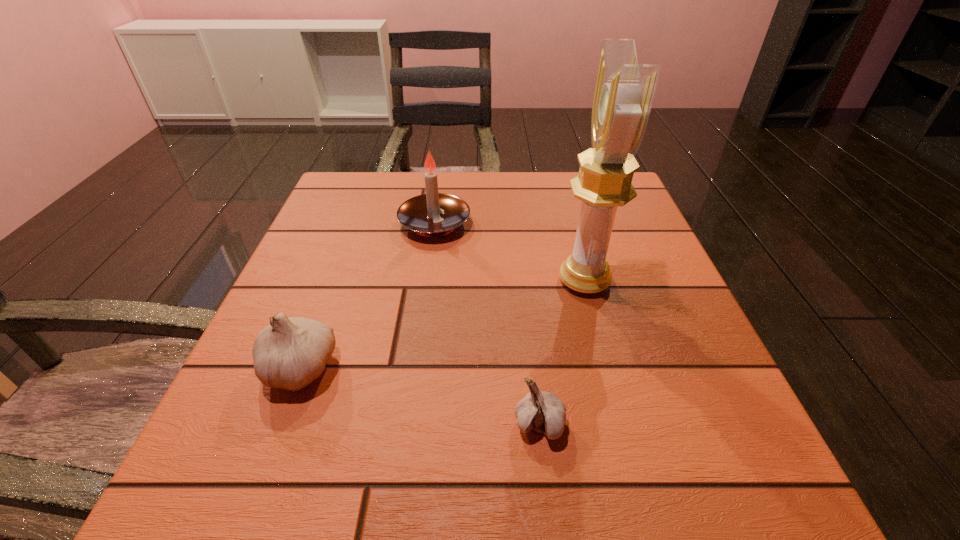
Find the location of a particular element. vacant area situated on the front-facing side of the rightmost object is located at coordinates (384, 281).

Locate an element on the screen. This screenshot has width=960, height=540. free space located on the right of the third object from right to left is located at coordinates (583, 223).

Locate an element on the screen. The height and width of the screenshot is (540, 960). free space located on the back of the taller garlic is located at coordinates (352, 228).

This screenshot has height=540, width=960. I want to click on vacant position located on the back of the second object from right to left, so click(527, 318).

You are a GUI agent. You are given a task and a screenshot of the screen. Output one action in this format:
    pyautogui.click(x=<x>, y=<y>)
    Task: Click on the object that is at the far edge
    The height and width of the screenshot is (540, 960).
    Given the screenshot: What is the action you would take?
    pyautogui.click(x=421, y=213)

Locate an element on the screen. object positioned at the near edge is located at coordinates (544, 412).

The image size is (960, 540). In order to click on object present at the left edge in this screenshot , I will do `click(290, 353)`.

At what (x,y) coordinates should I click in order to perform the action: click on object at the right edge. Please return your answer as a coordinate pair (x, y). The image size is (960, 540). Looking at the image, I should click on (624, 91).

In the image, there is a desktop. Find the location of `vacant space at the far edge`. vacant space at the far edge is located at coordinates (501, 186).

Find the location of a particular element. free region at the near edge is located at coordinates (570, 485).